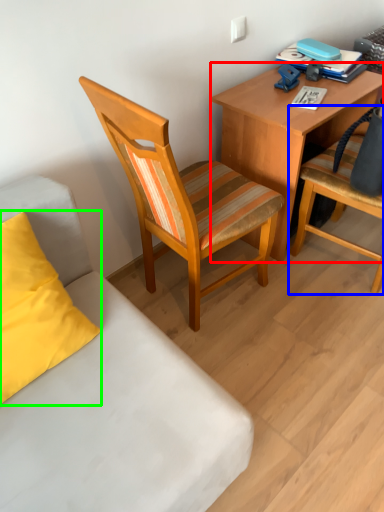
Question: Which object is positioned farthest from desk (highlighted by a red box)? Select from chair (highlighted by a blue box) and pillow (highlighted by a green box).

Choices:
 (A) chair
 (B) pillow

Answer: (B)